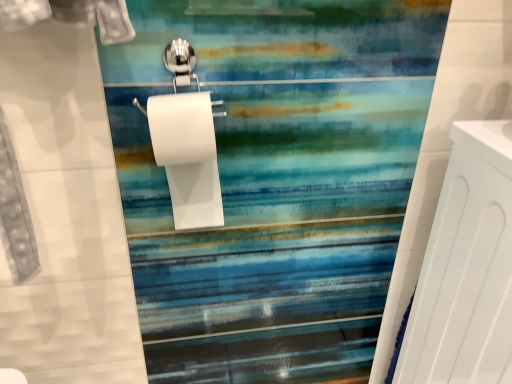
Question: Should I look upward or downward to see white matte radiator at right?

Choices:
 (A) down
 (B) up

Answer: (A)

Question: Is white matte radiator at right looking in the opposite direction of white matte toilet paper at center?

Choices:
 (A) yes
 (B) no

Answer: (B)

Question: Can we say white matte radiator at right lies outside white matte toilet paper at center?

Choices:
 (A) no
 (B) yes

Answer: (B)

Question: Could you tell me if white matte radiator at right is turned towards white matte toilet paper at center?

Choices:
 (A) no
 (B) yes

Answer: (A)

Question: Would you consider white matte radiator at right to be distant from white matte toilet paper at center?

Choices:
 (A) yes
 (B) no

Answer: (B)

Question: From the image's perspective, would you say white matte radiator at right is positioned over white matte toilet paper at center?

Choices:
 (A) no
 (B) yes

Answer: (A)

Question: Does white matte radiator at right have a lesser height compared to white matte toilet paper at center?

Choices:
 (A) no
 (B) yes

Answer: (A)

Question: Is white matte toilet paper at center shorter than white matte radiator at right?

Choices:
 (A) yes
 (B) no

Answer: (A)

Question: Can you confirm if white matte toilet paper at center is bigger than white matte radiator at right?

Choices:
 (A) no
 (B) yes

Answer: (A)

Question: Would you say white matte toilet paper at center is outside white matte radiator at right?

Choices:
 (A) no
 (B) yes

Answer: (B)

Question: Would you say white matte toilet paper at center contains white matte radiator at right?

Choices:
 (A) yes
 (B) no

Answer: (B)

Question: Considering the relative sizes of white matte toilet paper at center and white matte radiator at right in the image provided, is white matte toilet paper at center smaller than white matte radiator at right?

Choices:
 (A) no
 (B) yes

Answer: (B)

Question: Could you tell me if white matte toilet paper at center is turned towards white matte radiator at right?

Choices:
 (A) no
 (B) yes

Answer: (A)

Question: Do you think white matte toilet paper at center is within white matte radiator at right, or outside of it?

Choices:
 (A) outside
 (B) inside

Answer: (A)